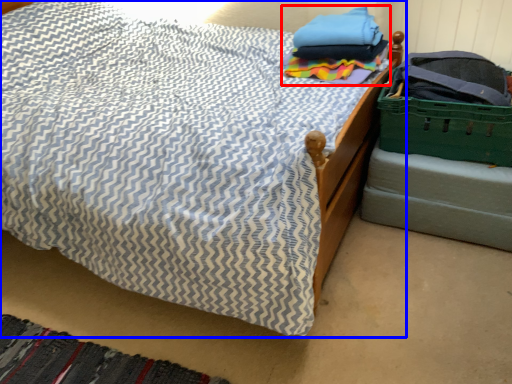
Question: Among these objects, which one is nearest to the camera, clothing (highlighted by a red box) or bed (highlighted by a blue box)?

Choices:
 (A) clothing
 (B) bed

Answer: (B)